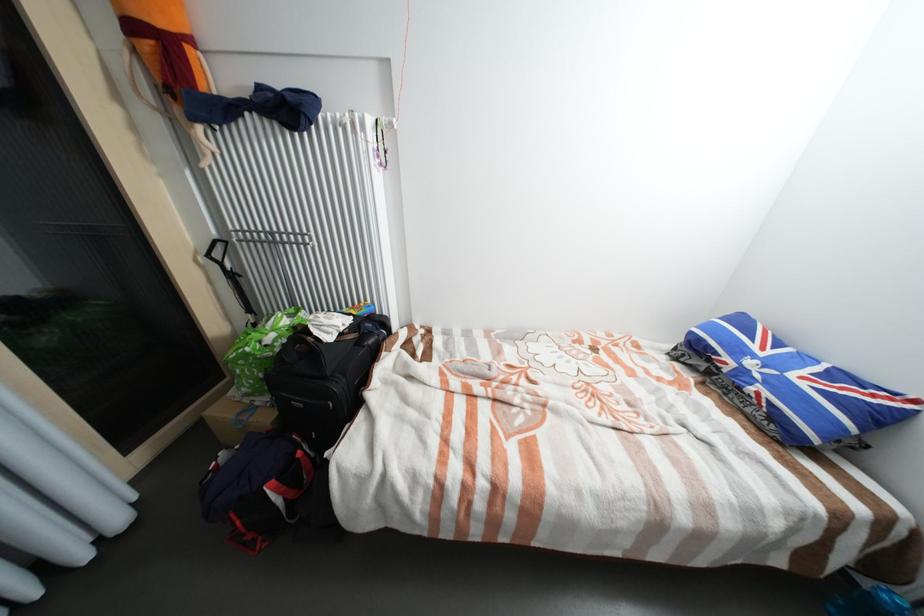
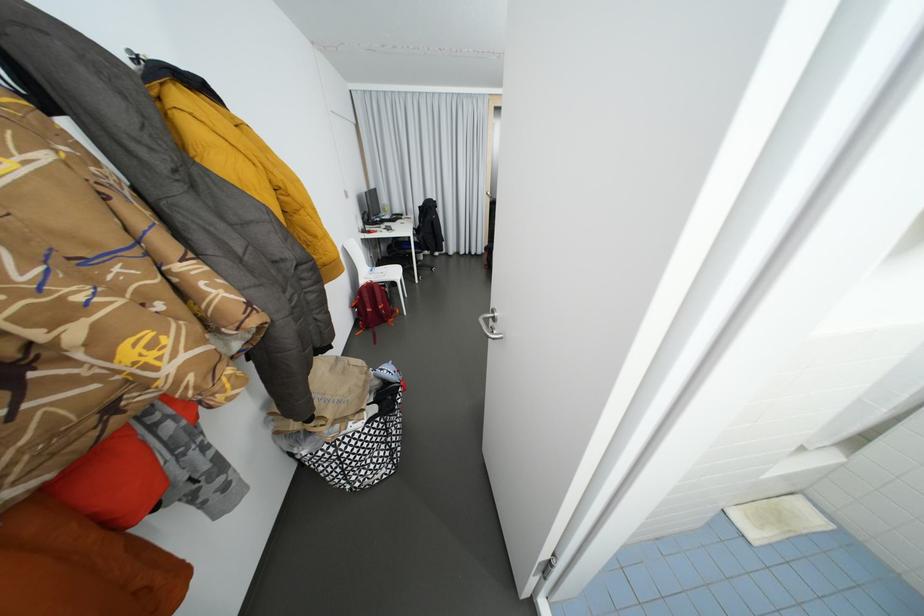
Question: I am providing you with two images of the same scene from different viewpoints. After the viewpoint changes to image2, which objects are now occluded?

Choices:
 (A) black luggage bag
 (B) white chair sitting surface
 (C) red backpack
 (D) small plant pot

Answer: (A)